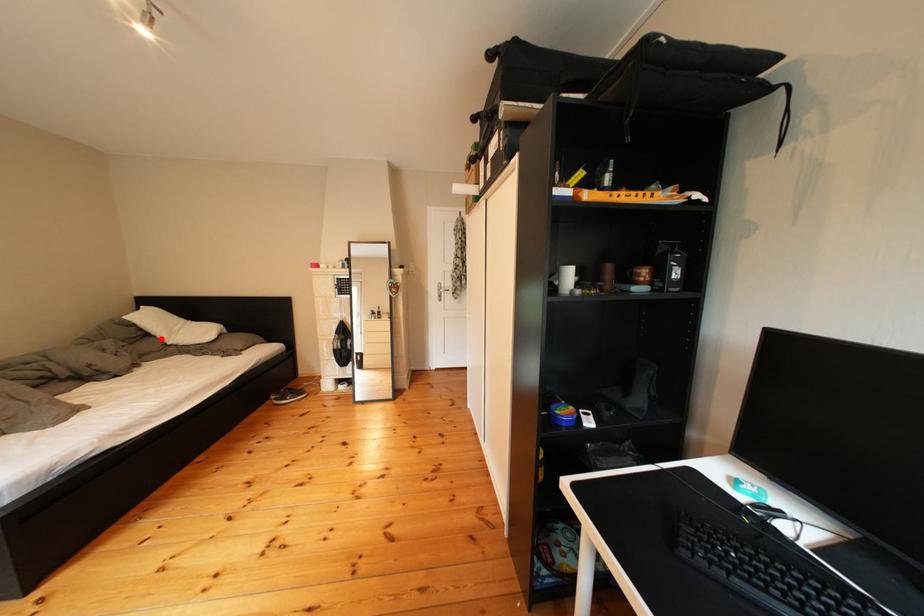
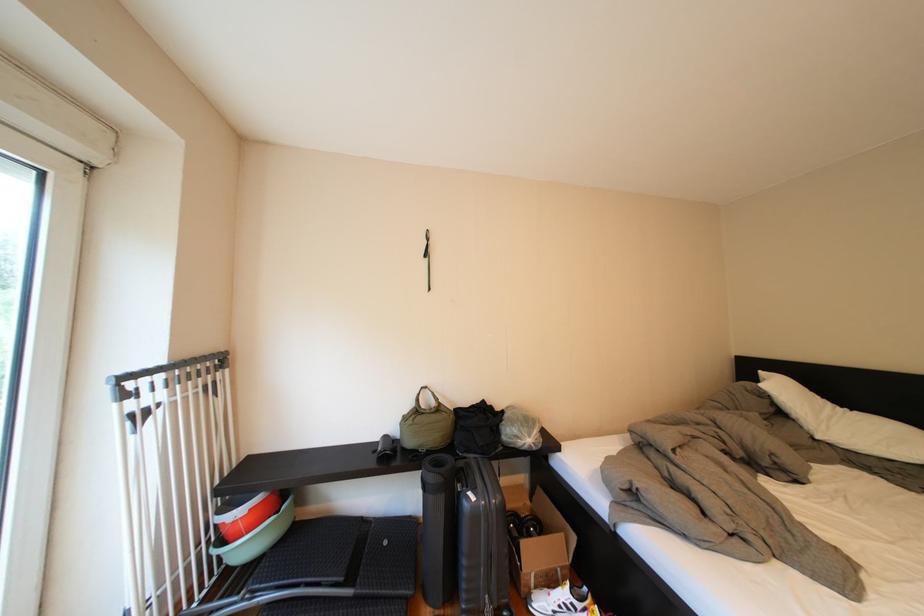
Question: I am providing you with two images of the same scene from different viewpoints. Given a red point in image1, look at the same physical point in image2. Is it:

Choices:
 (A) Closer to the viewpoint
 (B) Farther from the viewpoint

Answer: (A)